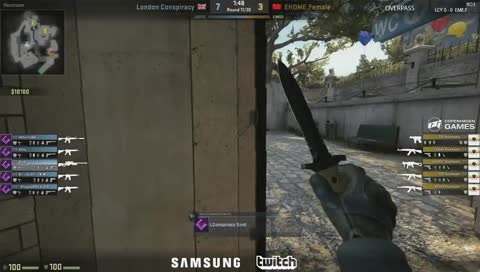
You are a GUI agent. You are given a task and a screenshot of the screen. Output one action in this format:
    pyautogui.click(x=<x>, y=<y>)
    Task: Click on the wall above the bench
    The height and width of the screenshot is (272, 480).
    Given the screenshot: What is the action you would take?
    pyautogui.click(x=378, y=118)